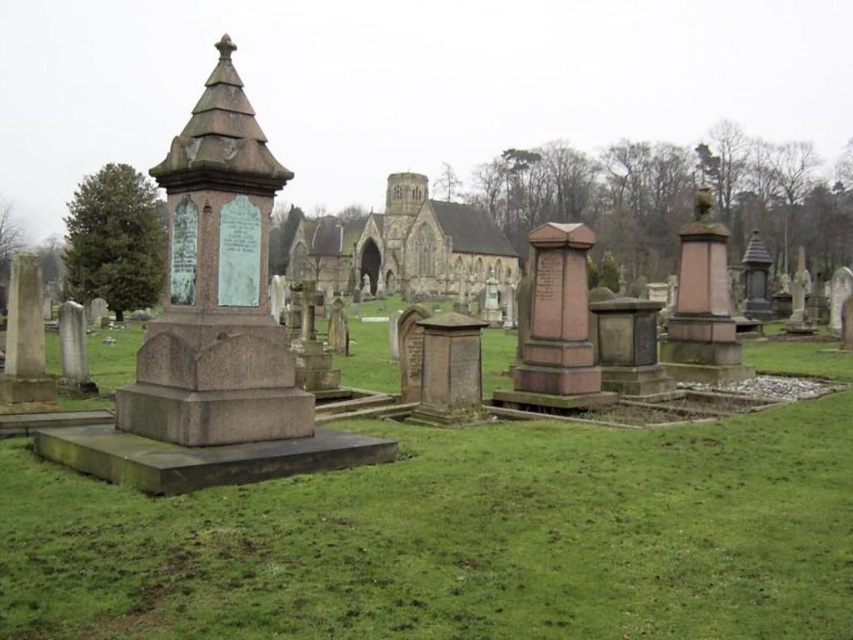
You are standing at the entrance of the cemetery and want to walk towards the brown stone church at center. Which direction should you walk relative to the green grass at center?

You should walk towards the brown stone church at center, which is behind the green grass at center. Since the green grass at center is in front of the brown stone church at center, you would need to walk away from the green grass at center to reach the church.

You are standing at the entrance of the cemetery and want to walk towards the green grass at center. Which direction should you head?

The green grass at center is located at point 0.844 on the x axis and 0.538 on the y axis, so you should head towards the direction of those coordinates.